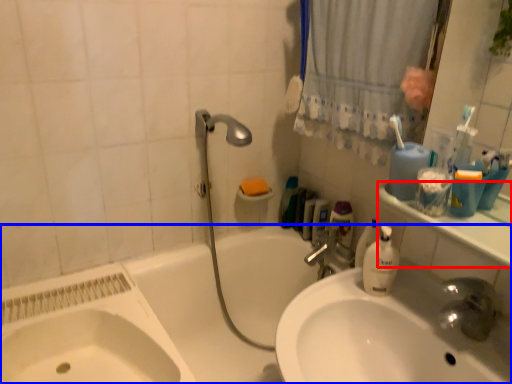
Question: Which point is closer to the camera, counter top (highlighted by a red box) or bathtub (highlighted by a blue box)?

Choices:
 (A) counter top
 (B) bathtub

Answer: (A)